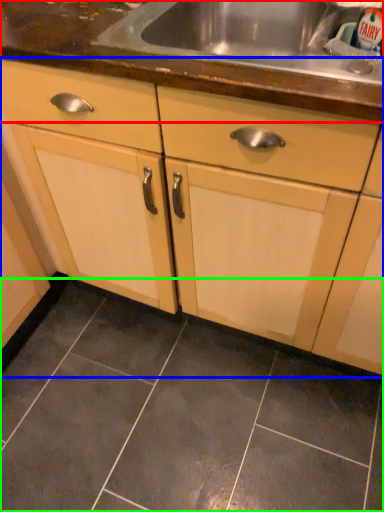
Question: Based on their relative distances, which object is farther from countertop (highlighted by a red box)? Choose from cabinetry (highlighted by a blue box) and ceramic tile (highlighted by a green box).

Choices:
 (A) cabinetry
 (B) ceramic tile

Answer: (B)